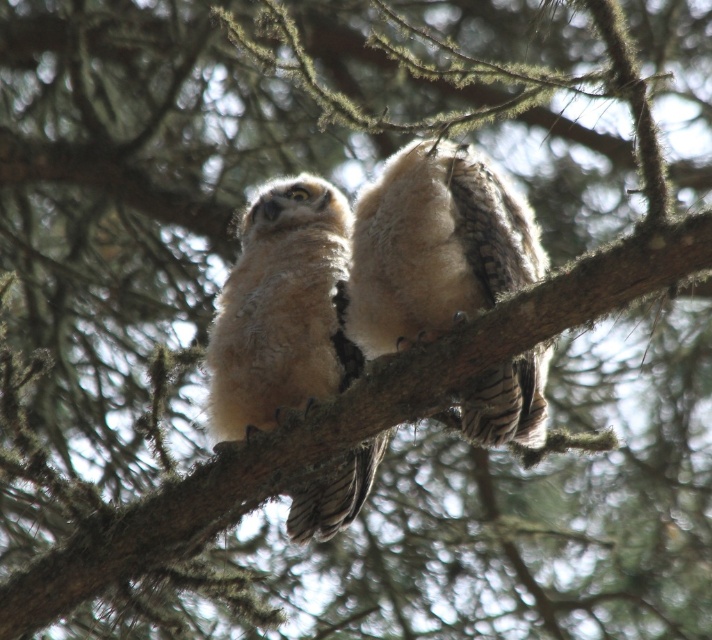
Question: Does fuzzy white owl at center have a lesser width compared to fuzzy beige owl at center?

Choices:
 (A) no
 (B) yes

Answer: (A)

Question: Among these objects, which one is nearest to the camera?

Choices:
 (A) fuzzy white owl at center
 (B) fuzzy beige owl at center

Answer: (A)

Question: Does fuzzy white owl at center appear over fuzzy beige owl at center?

Choices:
 (A) yes
 (B) no

Answer: (A)

Question: Which point is farther from the camera taking this photo?

Choices:
 (A) (335, 324)
 (B) (417, 141)

Answer: (A)

Question: In this image, where is fuzzy white owl at center located relative to fuzzy beige owl at center?

Choices:
 (A) above
 (B) below

Answer: (A)